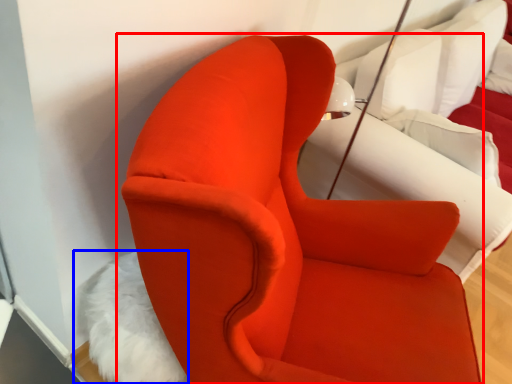
Question: Which object appears farthest to the camera in this image, chair (highlighted by a red box) or animal (highlighted by a blue box)?

Choices:
 (A) chair
 (B) animal

Answer: (B)